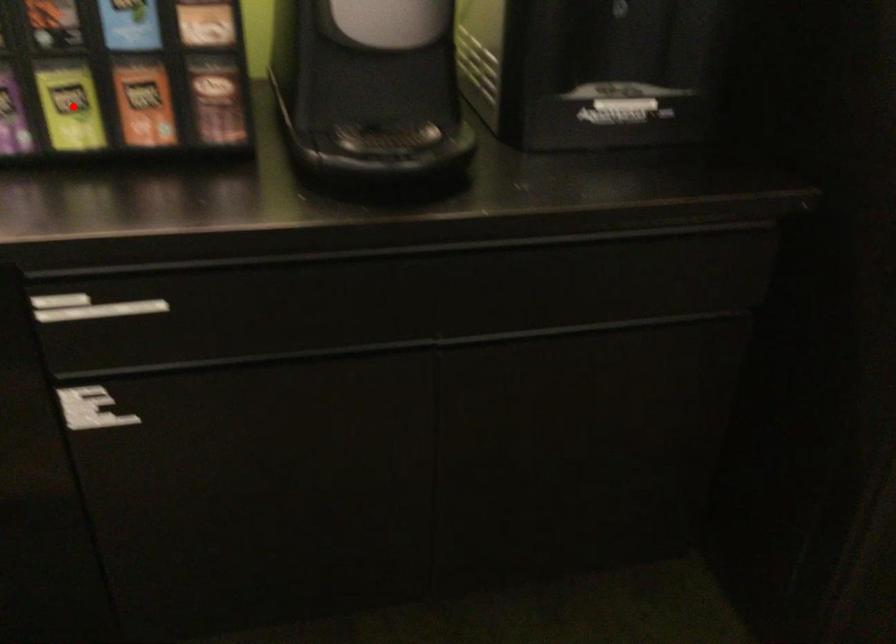
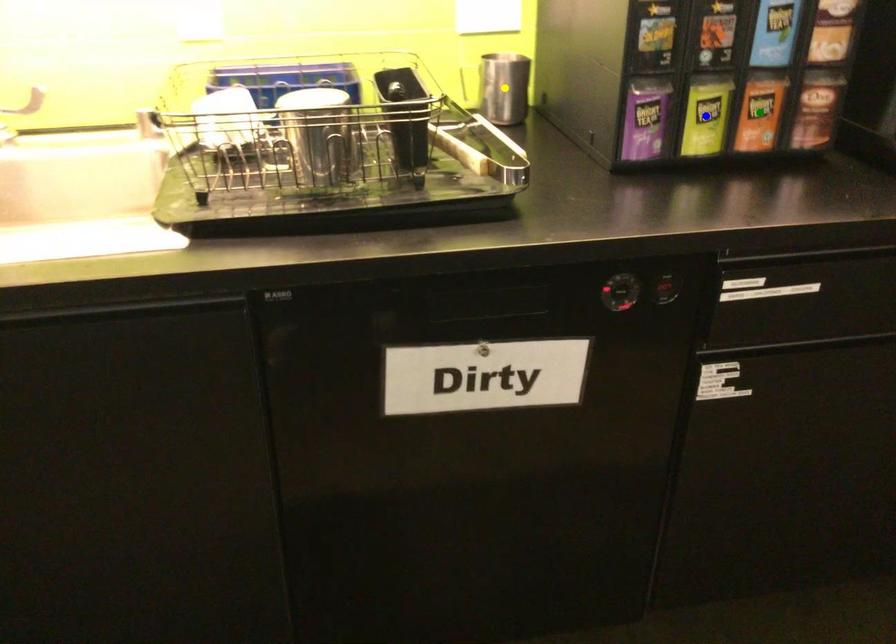
Question: I am providing you with two images of the same scene from different viewpoints. A red point is marked on the first image. You are given multiple points on the second image. Can you choose the point in image 2 that corresponds to the point in image 1?

Choices:
 (A) yellow point
 (B) green point
 (C) blue point

Answer: (C)